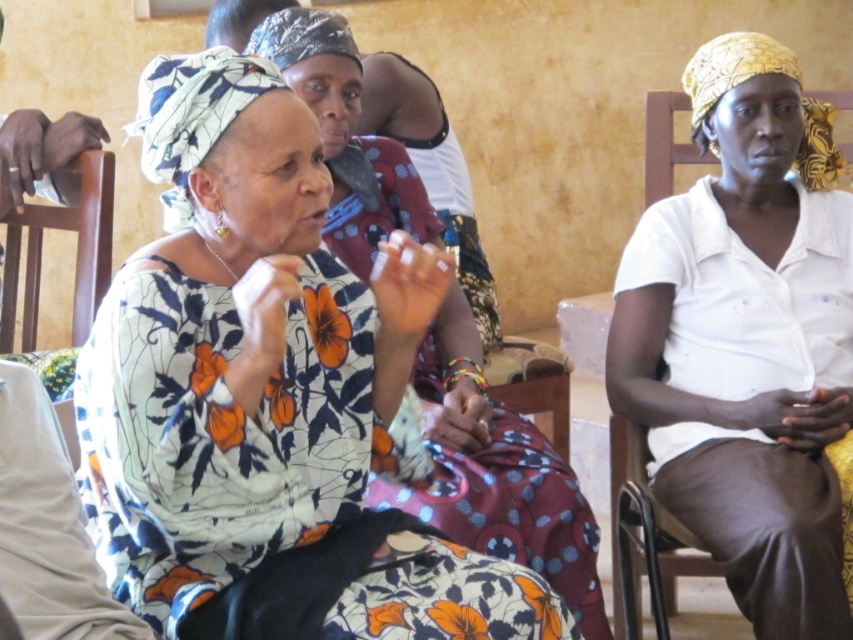
Is floral print dress at center taller than wooden chair at left?

Yes.

Is point (180, 579) more distant than point (78, 262)?

No, (180, 579) is closer to viewer.

Find the location of a particular element. floral print dress at center is located at coordinates (241, 348).

Consider the image. Who is higher up, floral print dress at center or white cotton shirt at center?

Positioned higher is white cotton shirt at center.

The width and height of the screenshot is (853, 640). In order to click on floral print dress at center in this screenshot , I will do `click(241, 348)`.

Find the location of `floral print dress at center`. floral print dress at center is located at coordinates (241, 348).

Between white cotton shirt at center and wooden chair at left, which one is positioned higher?

wooden chair at left is above.

Is point (637, 408) closer to viewer compared to point (106, 253)?

That is True.

The height and width of the screenshot is (640, 853). Identify the location of white cotton shirt at center. (747, 340).